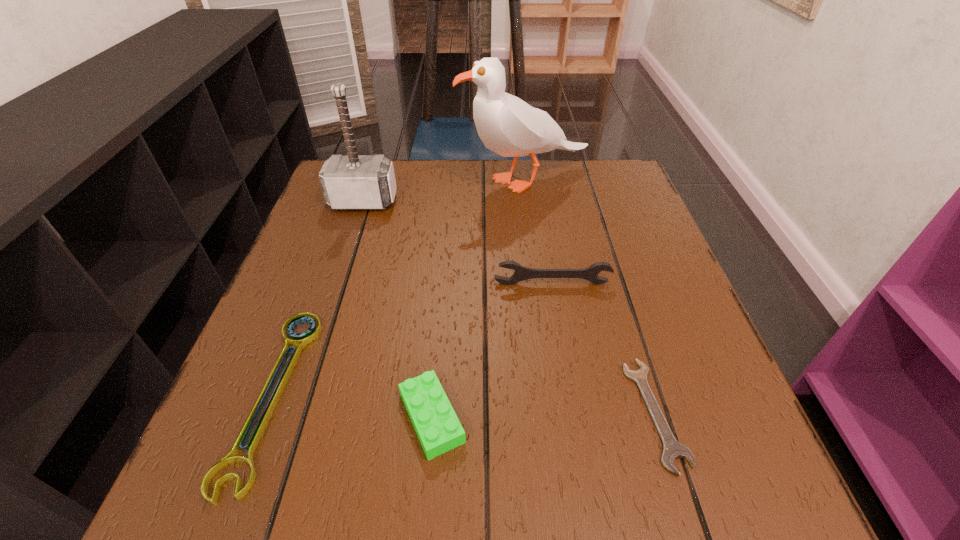
Where is `wrench that is at the left edge`? wrench that is at the left edge is located at coordinates (301, 340).

Where is `gull that is positioned at the right edge`? This screenshot has width=960, height=540. gull that is positioned at the right edge is located at coordinates (508, 126).

You are a GUI agent. You are given a task and a screenshot of the screen. Output one action in this format:
    pyautogui.click(x=<x>, y=<y>)
    Task: Click on the object situated at the far left corner
    
    Given the screenshot: What is the action you would take?
    pyautogui.click(x=350, y=182)

Locate an element on the screen. This screenshot has width=960, height=540. object that is at the near left corner is located at coordinates (301, 340).

You are a GUI agent. You are given a task and a screenshot of the screen. Output one action in this format:
    pyautogui.click(x=<x>, y=<y>)
    Task: Click on the object present at the far right corner
    
    Given the screenshot: What is the action you would take?
    pyautogui.click(x=508, y=126)

The image size is (960, 540). Identify the location of object positioned at the near right corner. point(672,449).

Where is `free region at the far edge of the desktop`? Image resolution: width=960 pixels, height=540 pixels. free region at the far edge of the desktop is located at coordinates (441, 171).

Image resolution: width=960 pixels, height=540 pixels. In order to click on free space at the near edge of the desktop in this screenshot , I will do `click(630, 462)`.

Locate an element on the screen. This screenshot has height=540, width=960. free location at the left edge of the desktop is located at coordinates (268, 323).

Find the location of a particular element. This screenshot has height=540, width=960. vacant space at the right edge of the desktop is located at coordinates (648, 252).